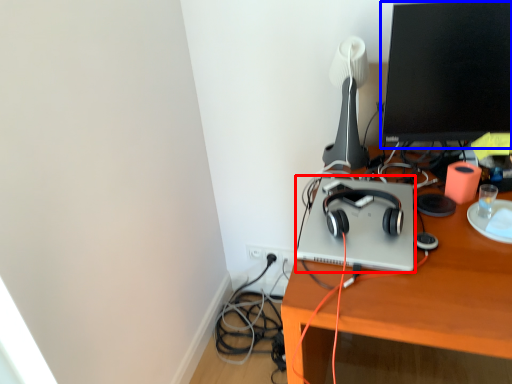
Question: Which of the following is the closest to the observer, computer (highlighted by a red box) or computer monitor (highlighted by a blue box)?

Choices:
 (A) computer
 (B) computer monitor

Answer: (A)